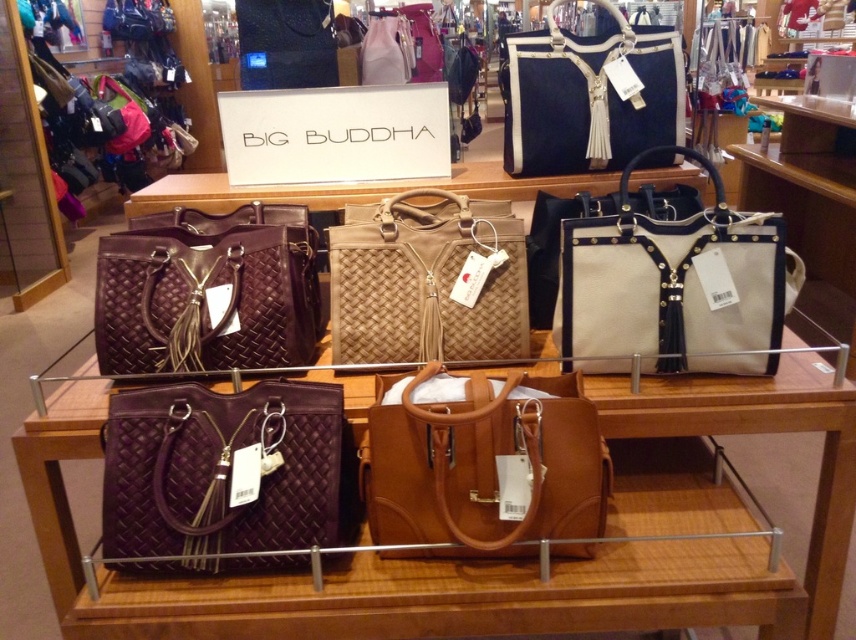
You are a customer in the store and want to find the tan leather tote at center. Based on the coordinates provided, can you determine its position relative to the other handbags in the display?

The tan leather tote at center is located at coordinates point (x=485, y=465), which places it centrally within the display area, likely positioned in the middle of the lower row of handbags.

In the scene shown: You are a customer in the store looking at the handbags. You want to pick up the matte purple woven tote at lower left and the tan woven tote at center. Which one do you need to move first to access the other?

The matte purple woven tote at lower left is in front of the tan woven tote at center, so you need to move the matte purple woven tote at lower left first to access the tan woven tote at center.

You are a customer in the store and want to pick up the matte brown woven tote at upper left and the black woven tote at upper center. Which one do you need to reach for first?

You should reach for the matte brown woven tote at upper left first because it is closer to you than the black woven tote at upper center.